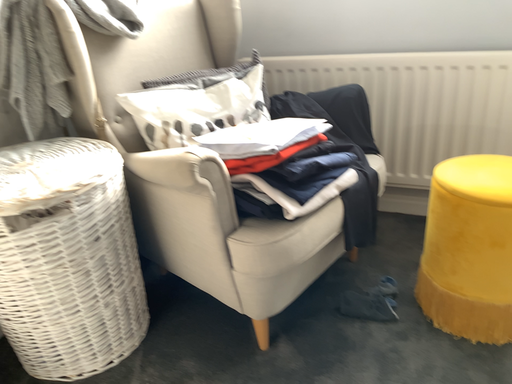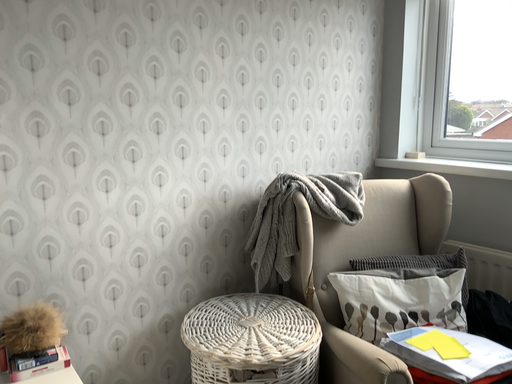
Question: Which way did the camera rotate in the video?

Choices:
 (A) rotated upward
 (B) rotated downward

Answer: (A)